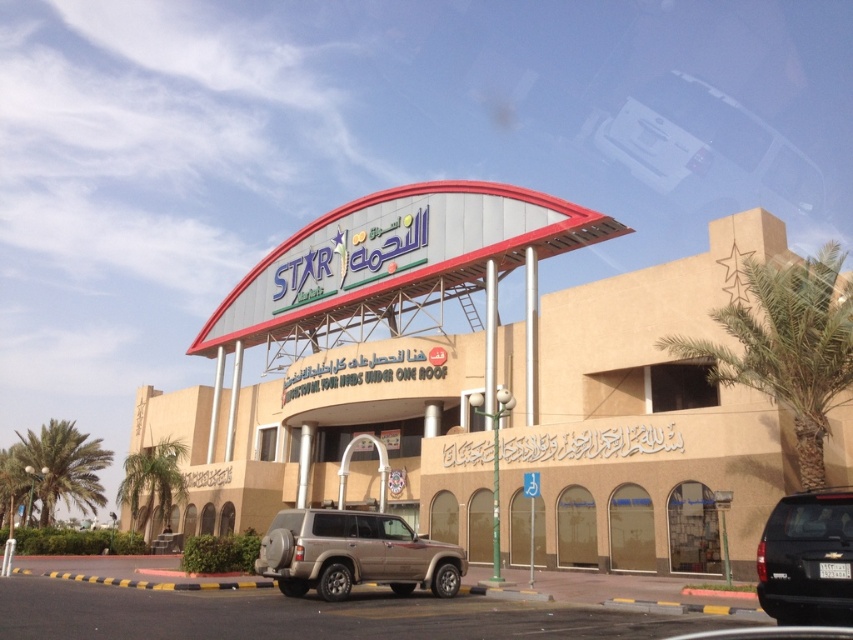
Question: Which point appears closest to the camera in this image?

Choices:
 (A) (444, 579)
 (B) (55, 436)
 (C) (668, 180)
 (D) (265, 397)

Answer: (A)

Question: Considering the real-world distances, which object is farthest from the white glossy car at upper center?

Choices:
 (A) green leafy palm tree at left
 (B) green leafy palm tree at right

Answer: (A)

Question: Is gold metallic suv at center above black matte suv at lower right?

Choices:
 (A) no
 (B) yes

Answer: (A)

Question: Can you confirm if beige concrete building at center is positioned below black matte suv at lower right?

Choices:
 (A) yes
 (B) no

Answer: (B)

Question: Is beige concrete building at center behind green leafy palm tree at left?

Choices:
 (A) no
 (B) yes

Answer: (A)

Question: Which is farther from the green leafy palm tree at lower left?

Choices:
 (A) beige concrete building at center
 (B) black matte suv at lower right
 (C) white glossy car at upper center
 (D) green leafy palm tree at left

Answer: (C)